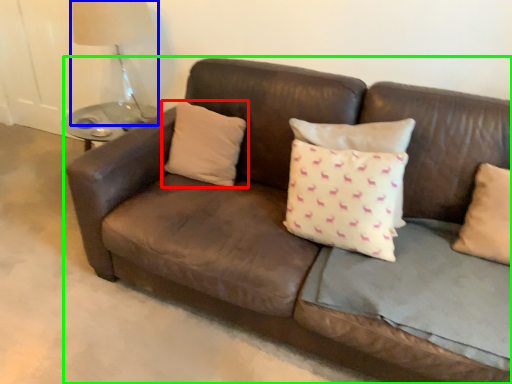
Question: Which is nearer to the pillow (highlighted by a red box)? table lamp (highlighted by a blue box) or studio couch (highlighted by a green box).

Choices:
 (A) table lamp
 (B) studio couch

Answer: (B)